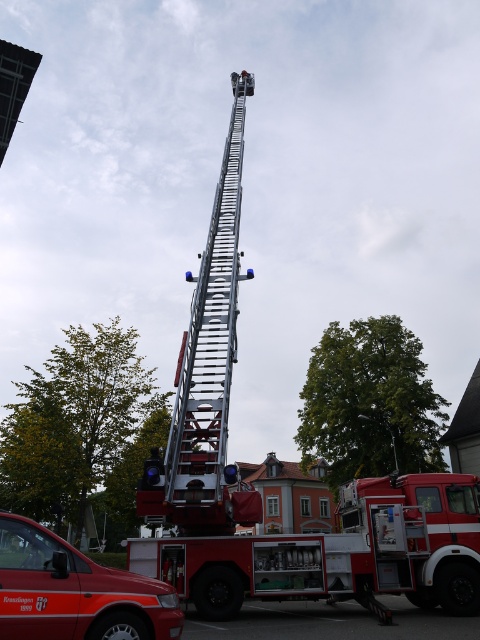
You are a firefighter trying to reach a window on the second floor. You see the metallic silver ladder at center and the silver metallic ladder at upper center. Which ladder is positioned closer to you?

The metallic silver ladder at center is closer to the viewer than the silver metallic ladder at upper center, so the metallic silver ladder at center is positioned closer to you.

You are standing at the point marked as point [195,355]. The fire truck with its ladder is 41.77 feet away from you. If you want to move closer to the fire truck, which direction should you walk? Please answer with either north, south, east, or west.

The fire truck with its ladder is 41.77 feet away from point [195,355]. To move closer to the fire truck, you should walk north.

You are a firefighter assessing the scene. You notice two ladders in the image. Which ladder, the metallic silver ladder at center or the silver metallic ladder at upper center, is taller?

The metallic silver ladder at center is taller than the silver metallic ladder at upper center according to the description.